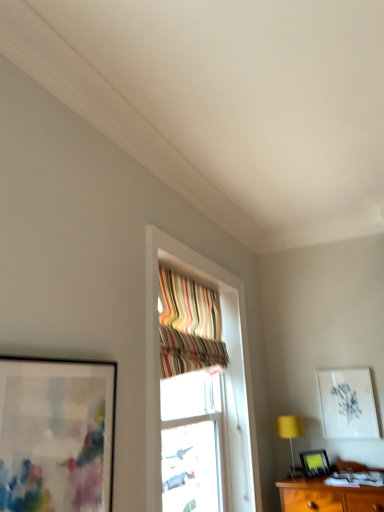
Question: Is matte black picture frame at lower right, the 2th picture frame positioned from the right, taller than yellow fabric table lamp at lower right?

Choices:
 (A) no
 (B) yes

Answer: (A)

Question: Considering the relative positions of matte black picture frame at lower right, the second picture frame from the left, and yellow fabric table lamp at lower right in the image provided, is matte black picture frame at lower right, the second picture frame from the left, to the right of yellow fabric table lamp at lower right from the viewer's perspective?

Choices:
 (A) no
 (B) yes

Answer: (B)

Question: Considering the relative sizes of matte black picture frame at lower right, the 2th picture frame positioned from the right, and yellow fabric table lamp at lower right in the image provided, is matte black picture frame at lower right, the 2th picture frame positioned from the right, thinner than yellow fabric table lamp at lower right?

Choices:
 (A) no
 (B) yes

Answer: (B)

Question: Is matte black picture frame at lower right, the first picture frame positioned from the bottom, placed right next to yellow fabric table lamp at lower right?

Choices:
 (A) no
 (B) yes

Answer: (A)

Question: Does matte black picture frame at lower right, which is the third picture frame in top-to-bottom order, lie behind yellow fabric table lamp at lower right?

Choices:
 (A) no
 (B) yes

Answer: (B)

Question: Would you say matte black picture frame at lower right, the second picture frame from the left, is outside yellow fabric table lamp at lower right?

Choices:
 (A) yes
 (B) no

Answer: (A)

Question: Considering the relative sizes of matte black picture frame at left, marked as the first picture frame in a top-to-bottom arrangement, and white paper at upper right, which is counted as the 2th picture frame, starting from the bottom, in the image provided, is matte black picture frame at left, marked as the first picture frame in a top-to-bottom arrangement, smaller than white paper at upper right, which is counted as the 2th picture frame, starting from the bottom,?

Choices:
 (A) no
 (B) yes

Answer: (A)

Question: Is matte black picture frame at left, the first picture frame when ordered from front to back, positioned behind white paper at upper right, the first picture frame when ordered from back to front?

Choices:
 (A) yes
 (B) no

Answer: (B)

Question: Does matte black picture frame at left, placed as the 1th picture frame when sorted from left to right, appear on the right side of white paper at upper right, the first picture frame when ordered from back to front?

Choices:
 (A) no
 (B) yes

Answer: (A)

Question: Is matte black picture frame at left, the first picture frame when ordered from front to back, surrounding white paper at upper right, positioned as the 3th picture frame in front-to-back order?

Choices:
 (A) no
 (B) yes

Answer: (A)

Question: From the image's perspective, is matte black picture frame at left, arranged as the third picture frame when viewed from the back, under white paper at upper right, which appears as the second picture frame when viewed from the top?

Choices:
 (A) no
 (B) yes

Answer: (A)

Question: From a real-world perspective, does matte black picture frame at left, acting as the third picture frame starting from the bottom, sit lower than white paper at upper right, positioned as the 3th picture frame in front-to-back order?

Choices:
 (A) yes
 (B) no

Answer: (A)

Question: Considering the relative positions of striped fabric curtain at upper center and white paper at upper right, placed as the 3th picture frame when sorted from left to right, in the image provided, is striped fabric curtain at upper center to the left of white paper at upper right, placed as the 3th picture frame when sorted from left to right, from the viewer's perspective?

Choices:
 (A) yes
 (B) no

Answer: (A)